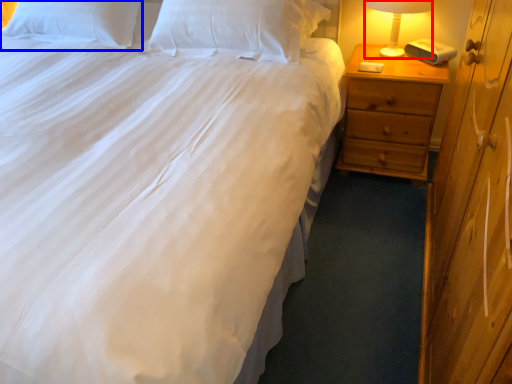
Question: Which object is further to the camera taking this photo, bedside lamp (highlighted by a red box) or pillow (highlighted by a blue box)?

Choices:
 (A) bedside lamp
 (B) pillow

Answer: (B)